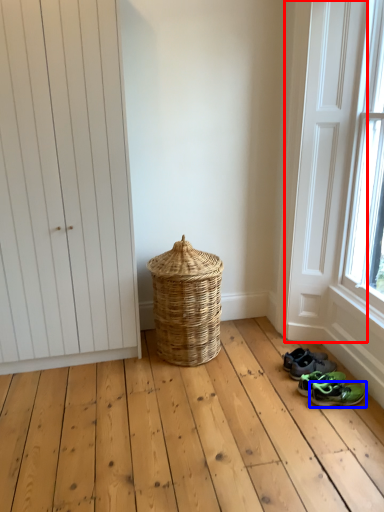
Question: Which object appears closest to the camera in this image, screen door (highlighted by a red box) or footwear (highlighted by a blue box)?

Choices:
 (A) screen door
 (B) footwear

Answer: (A)